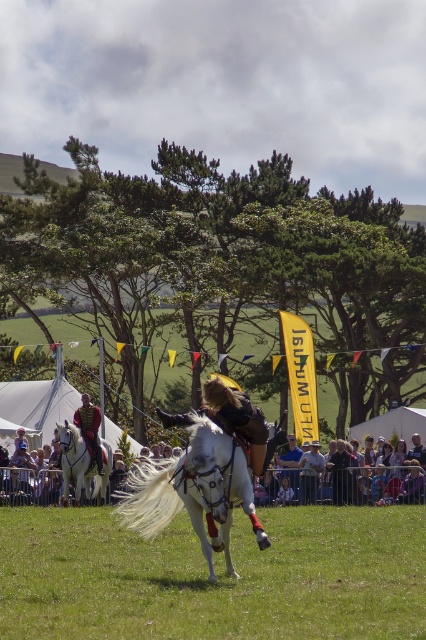
In the scene shown: Can you confirm if white glossy horse at center is shorter than smooth fabric crowd at center?

Incorrect, white glossy horse at center's height does not fall short of smooth fabric crowd at center's.

Between white glossy horse at center and smooth fabric crowd at center, which one is positioned lower?

smooth fabric crowd at center is below.

What do you see at coordinates (195, 492) in the screenshot? I see `white glossy horse at center` at bounding box center [195, 492].

What are the coordinates of `white glossy horse at center` in the screenshot? It's located at (195, 492).

Based on the photo, is white glossy horse at center smaller than white glossy horse at left?

No, white glossy horse at center is not smaller than white glossy horse at left.

Based on the photo, which of these two, white glossy horse at center or white glossy horse at left, stands taller?

With more height is white glossy horse at center.

Does point (203, 497) come farther from viewer compared to point (63, 464)?

That is False.

The width and height of the screenshot is (426, 640). Identify the location of white glossy horse at center. (195, 492).

Does green grass at center have a lesser height compared to white glossy horse at left?

Yes.

Is green grass at center closer to camera compared to white glossy horse at left?

Yes, green grass at center is in front of white glossy horse at left.

What are the coordinates of `green grass at center` in the screenshot? It's located at (218, 577).